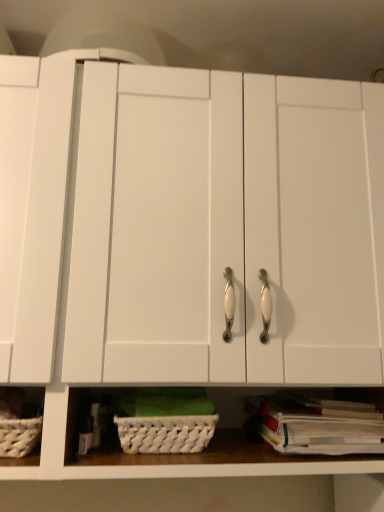
Locate an element on the screen. empty space that is ontop of white paper book at lower right (from a real-world perspective) is located at coordinates (305, 391).